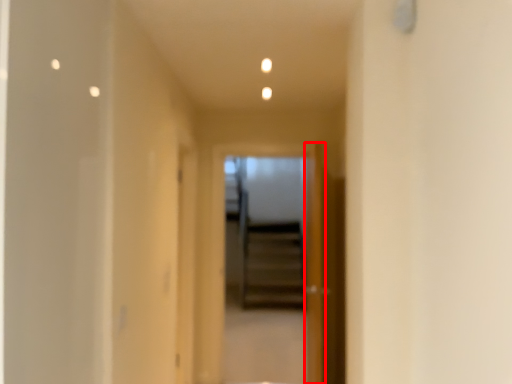
Question: From the image's perspective, where is door (annotated by the red box) located relative to screen door?

Choices:
 (A) below
 (B) above

Answer: (A)